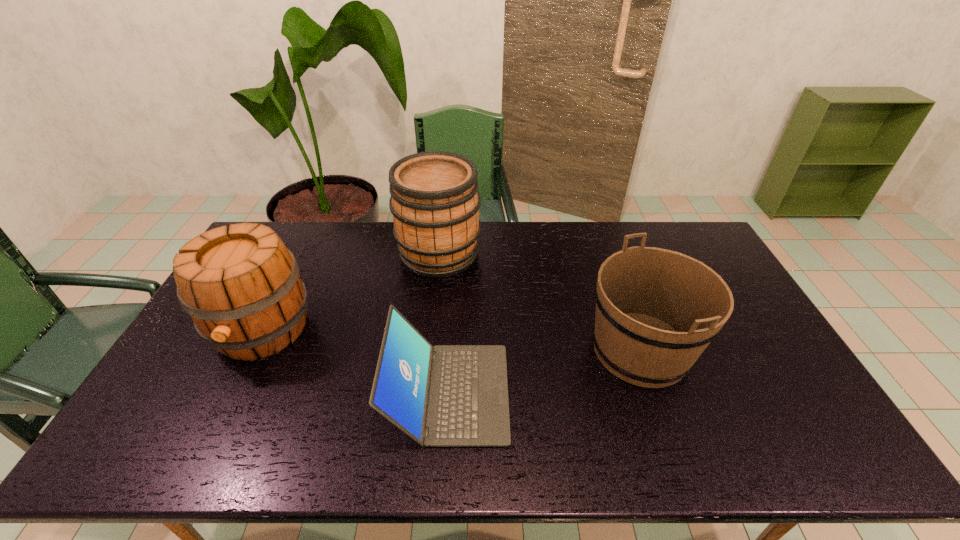
Locate an element on the screen. The image size is (960, 540). blank space that satisfies the following two spatial constraints: 1. on the side of the nearer cider where the spigot is located; 2. on the right side of the bucket is located at coordinates (252, 350).